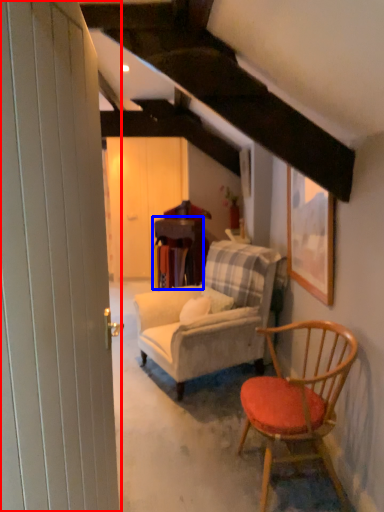
Question: Among these objects, which one is nearest to the camera, barn door (highlighted by a red box) or table (highlighted by a blue box)?

Choices:
 (A) barn door
 (B) table

Answer: (A)